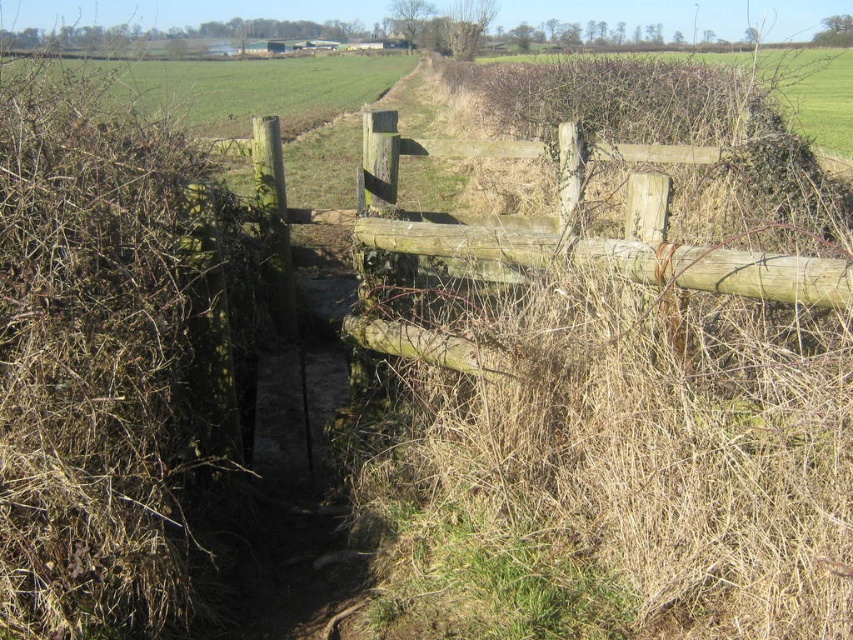
Question: Does brown dry hedge at left have a lesser width compared to green grass at upper left?

Choices:
 (A) yes
 (B) no

Answer: (A)

Question: Is green grass at upper left to the left of brown dry grass at upper center from the viewer's perspective?

Choices:
 (A) no
 (B) yes

Answer: (B)

Question: Is brown dry hedge at left further to camera compared to brown dry grass at upper center?

Choices:
 (A) no
 (B) yes

Answer: (A)

Question: Which object appears farthest from the camera in this image?

Choices:
 (A) weathered wood gate at center
 (B) brown dry hedge at left
 (C) brown dry grass at upper center
 (D) green grass at upper left

Answer: (C)

Question: Which object is positioned closest to the brown dry grass at upper center?

Choices:
 (A) weathered wood gate at center
 (B) green grass at upper left
 (C) brown dry hedge at left

Answer: (B)

Question: Which is farther from the green grass at upper left?

Choices:
 (A) brown dry hedge at left
 (B) brown dry grass at upper center

Answer: (A)